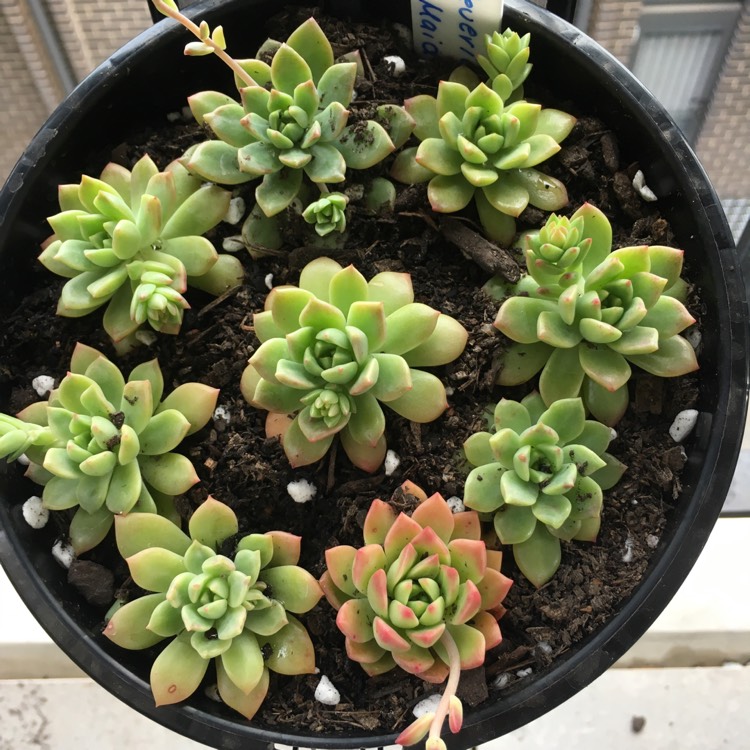
This screenshot has height=750, width=750. Identify the location of top rim of pot. (136, 36), (28, 154), (590, 42), (681, 147), (705, 494), (594, 657), (181, 718), (45, 606).